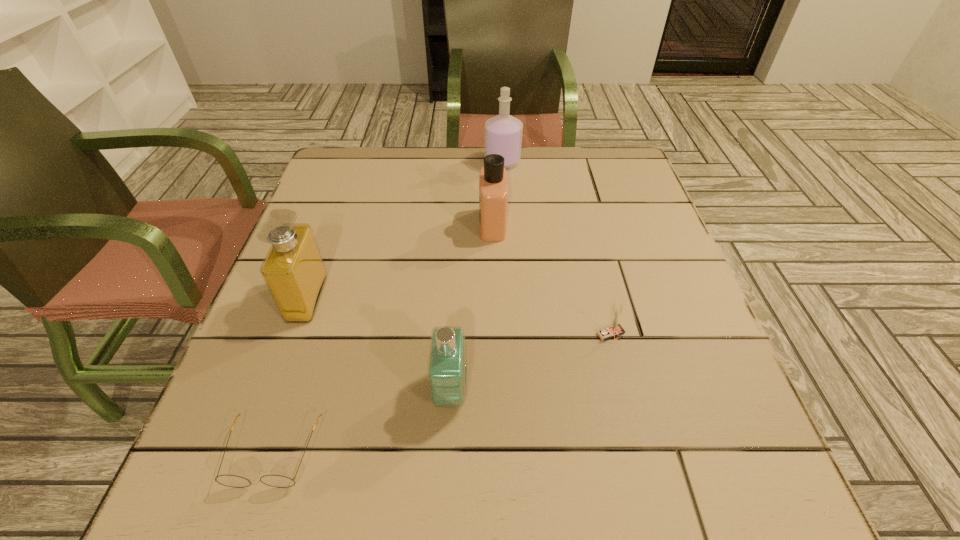
I want to click on object at the right edge, so click(x=615, y=329).

Locate an element on the screen. The image size is (960, 540). object that is at the near left corner is located at coordinates (278, 481).

At what (x,y) coordinates should I click in order to perform the action: click on blank area at the far edge. Please return your answer as a coordinate pair (x, y). Image resolution: width=960 pixels, height=540 pixels. Looking at the image, I should click on (416, 190).

In the image, there is a desktop. At what (x,y) coordinates should I click in order to perform the action: click on free region at the near edge. Please return your answer as a coordinate pair (x, y). Looking at the image, I should click on (309, 506).

This screenshot has height=540, width=960. I want to click on free space at the left edge of the desktop, so click(x=259, y=403).

Find the location of a particular element. The height and width of the screenshot is (540, 960). free space at the right edge is located at coordinates (736, 422).

This screenshot has height=540, width=960. In order to click on free space at the near left corner of the desktop in this screenshot , I will do `click(199, 500)`.

You are a GUI agent. You are given a task and a screenshot of the screen. Output one action in this format:
    pyautogui.click(x=<x>, y=<y>)
    Task: Click on the vacant space at the far right corner
    This screenshot has height=540, width=960.
    Given the screenshot: What is the action you would take?
    pyautogui.click(x=579, y=151)

At what (x,y) coordinates should I click in order to perform the action: click on vacant space at the near right corner. Please return your answer as a coordinate pair (x, y). The image size is (960, 540). Looking at the image, I should click on (663, 469).

Locate an element on the screen. empty location between the third nearest perfume and the nearest perfume is located at coordinates (471, 308).